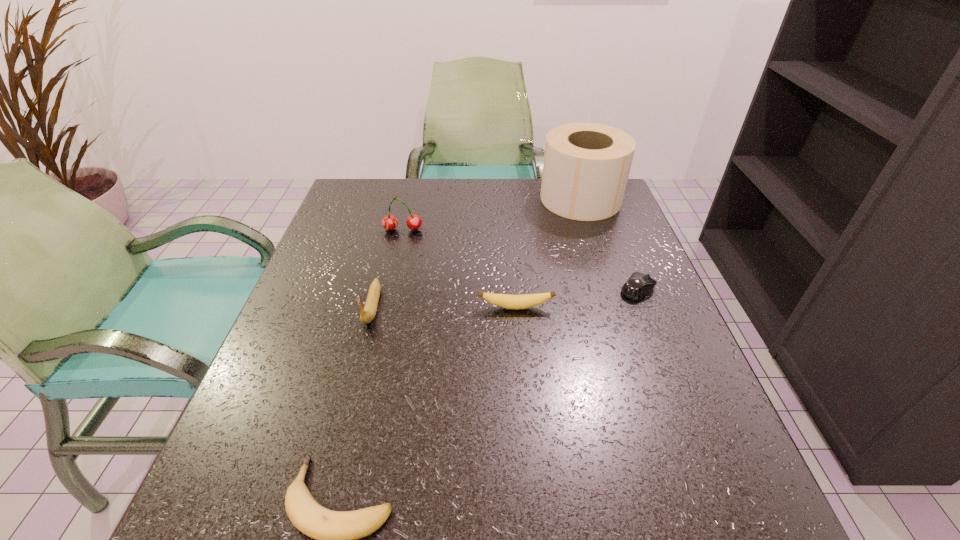
The width and height of the screenshot is (960, 540). I want to click on the farthest object, so click(x=586, y=166).

The width and height of the screenshot is (960, 540). In order to click on toilet tissue in this screenshot , I will do `click(586, 166)`.

Find the location of a particular element. The height and width of the screenshot is (540, 960). cherry is located at coordinates [389, 222].

Where is `the tallest banana`? This screenshot has width=960, height=540. the tallest banana is located at coordinates (368, 313).

Where is `the rightmost banana`? the rightmost banana is located at coordinates (524, 301).

Image resolution: width=960 pixels, height=540 pixels. What are the coordinates of `the third object from right to left` in the screenshot? It's located at (524, 301).

What are the coordinates of `mouse` in the screenshot? It's located at (639, 285).

The height and width of the screenshot is (540, 960). In order to click on blank space located 0.310m on the left of the toilet tissue in this screenshot , I will do `click(433, 199)`.

At what (x,y) coordinates should I click in order to perform the action: click on vacant space located 0.230m with stems pointing upwards on the cherry. Please return your answer as a coordinate pair (x, y). The width and height of the screenshot is (960, 540). Looking at the image, I should click on (388, 296).

Where is `vacant region located 0.150m at the stem of the tallest banana`? The width and height of the screenshot is (960, 540). vacant region located 0.150m at the stem of the tallest banana is located at coordinates (349, 395).